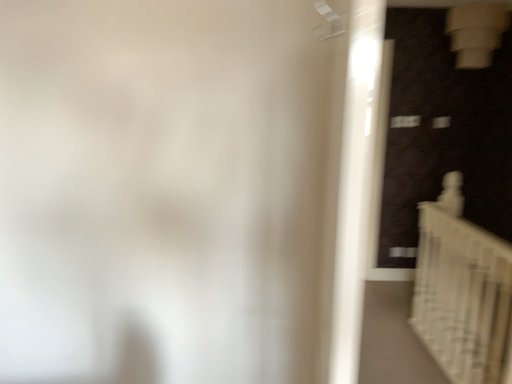
Question: Is there a large distance between white glossy staircase at lower right and white glossy door at right?

Choices:
 (A) no
 (B) yes

Answer: (B)

Question: Considering the relative sizes of white glossy staircase at lower right and white glossy door at right in the image provided, is white glossy staircase at lower right wider than white glossy door at right?

Choices:
 (A) yes
 (B) no

Answer: (B)

Question: Considering the relative sizes of white glossy staircase at lower right and white glossy door at right in the image provided, is white glossy staircase at lower right thinner than white glossy door at right?

Choices:
 (A) no
 (B) yes

Answer: (B)

Question: Is white glossy staircase at lower right looking in the opposite direction of white glossy door at right?

Choices:
 (A) yes
 (B) no

Answer: (B)

Question: From the image's perspective, is white glossy staircase at lower right over white glossy door at right?

Choices:
 (A) no
 (B) yes

Answer: (A)

Question: Considering the relative positions of white glossy staircase at lower right and white glossy door at right in the image provided, is white glossy staircase at lower right in front of white glossy door at right?

Choices:
 (A) no
 (B) yes

Answer: (A)

Question: From a real-world perspective, is white glossy door at right positioned over white glossy staircase at lower right based on gravity?

Choices:
 (A) no
 (B) yes

Answer: (B)

Question: Is white glossy door at right surrounding white glossy staircase at lower right?

Choices:
 (A) yes
 (B) no

Answer: (B)

Question: Could you tell me if white glossy door at right is facing white glossy staircase at lower right?

Choices:
 (A) yes
 (B) no

Answer: (B)

Question: Can you confirm if white glossy door at right is positioned to the right of white glossy staircase at lower right?

Choices:
 (A) yes
 (B) no

Answer: (B)

Question: From a real-world perspective, is white glossy door at right physically below white glossy staircase at lower right?

Choices:
 (A) no
 (B) yes

Answer: (A)

Question: Would you say white glossy door at right is outside white glossy staircase at lower right?

Choices:
 (A) no
 (B) yes

Answer: (B)

Question: Does point (353, 281) appear closer or farther from the camera than point (437, 203)?

Choices:
 (A) farther
 (B) closer

Answer: (B)